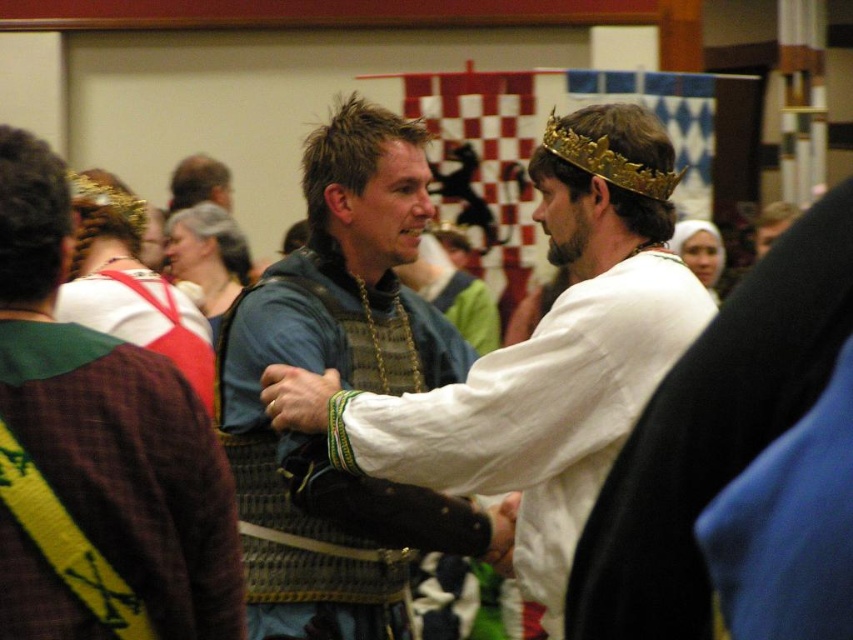
Question: Can you confirm if matte blue armor at center is positioned below green fabric sash at left?

Choices:
 (A) no
 (B) yes

Answer: (A)

Question: Which point is closer to the camera?

Choices:
 (A) pyautogui.click(x=776, y=220)
 (B) pyautogui.click(x=566, y=154)

Answer: (B)

Question: Can you confirm if green fabric sash at left is positioned to the right of gold metallic crown at center?

Choices:
 (A) no
 (B) yes

Answer: (A)

Question: Which of the following is the farthest from the observer?

Choices:
 (A) matte blue armor at center
 (B) gold metallic crown at center
 (C) white fabric crown at center

Answer: (C)

Question: In this image, where is green fabric sash at left located relative to gold metallic crown at center?

Choices:
 (A) left
 (B) right

Answer: (A)

Question: Which of the following is the closest to the observer?

Choices:
 (A) pyautogui.click(x=758, y=216)
 (B) pyautogui.click(x=605, y=381)
 (C) pyautogui.click(x=616, y=177)
 (D) pyautogui.click(x=112, y=339)

Answer: (D)